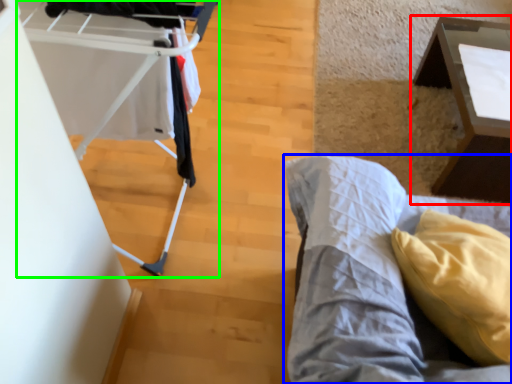
Question: Based on their relative distances, which object is nearer to table (highlighted by a red box)? Choose from furniture (highlighted by a blue box) and baby carriage (highlighted by a green box).

Choices:
 (A) furniture
 (B) baby carriage

Answer: (A)